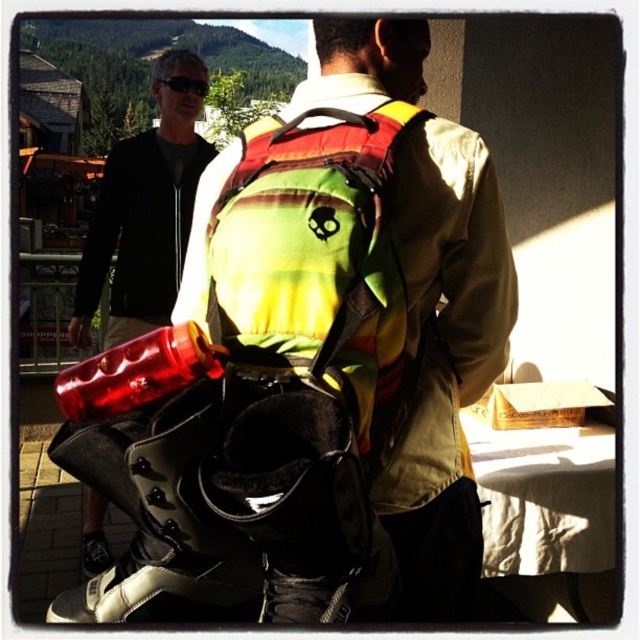
You are standing at the point with coordinates point (168,88) and want to walk to the point with coordinates point (336,141). Which direction should you move relative to your current position?

You should move forward because point (336,141) is in front of point (168,88).